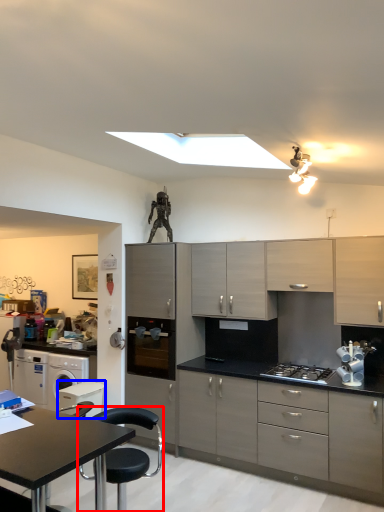
Question: Among these objects, which one is farthest to the camera, chair (highlighted by a red box) or appliance (highlighted by a blue box)?

Choices:
 (A) chair
 (B) appliance

Answer: (B)